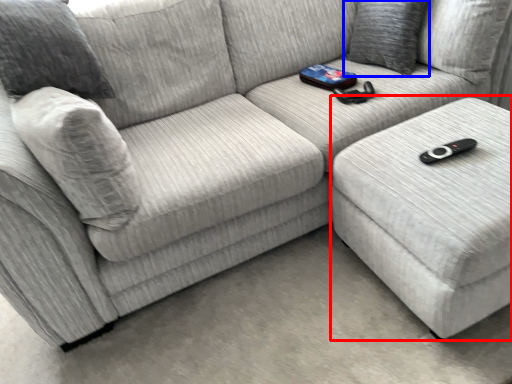
Question: Which point is further to the camera, table (highlighted by a red box) or pillow (highlighted by a blue box)?

Choices:
 (A) table
 (B) pillow

Answer: (B)